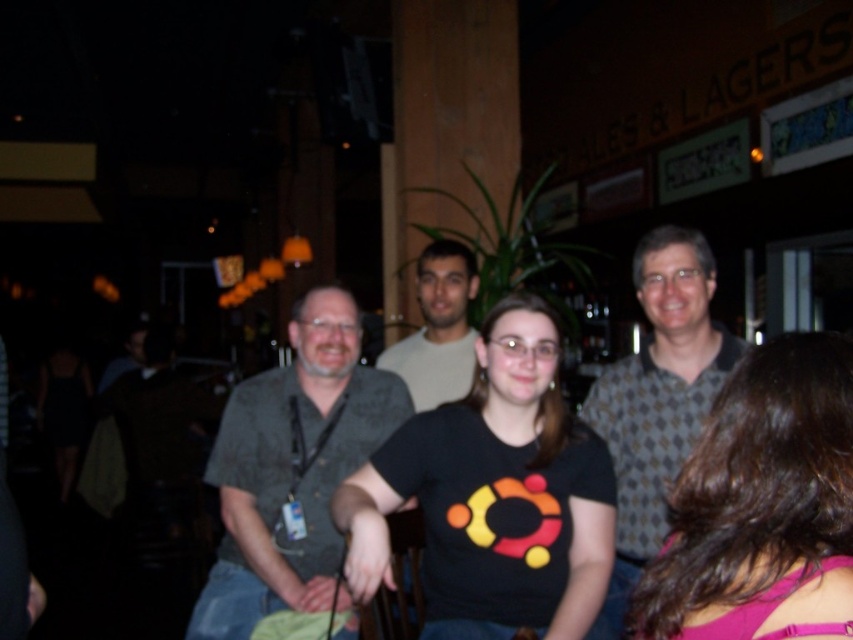
You are organizing a photo shoot and want to ensure that the dark brown hair at center and the light beige shirt at center are visible in the frame. Based on their sizes, which one is narrower and might require more careful framing to avoid being cut off?

The dark brown hair at center has a lesser width compared to the light beige shirt at center, so it is narrower and might require more careful framing to avoid being cut off.